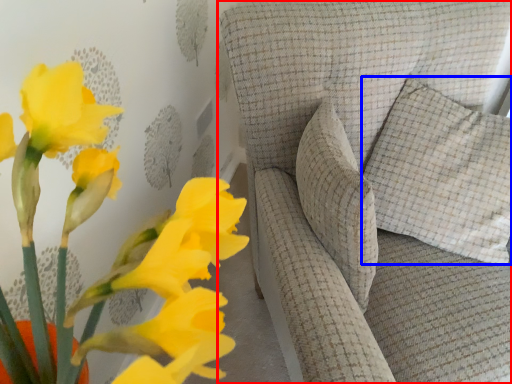
Question: Which object appears closest to the camera in this image, furniture (highlighted by a red box) or pillow (highlighted by a blue box)?

Choices:
 (A) furniture
 (B) pillow

Answer: (A)